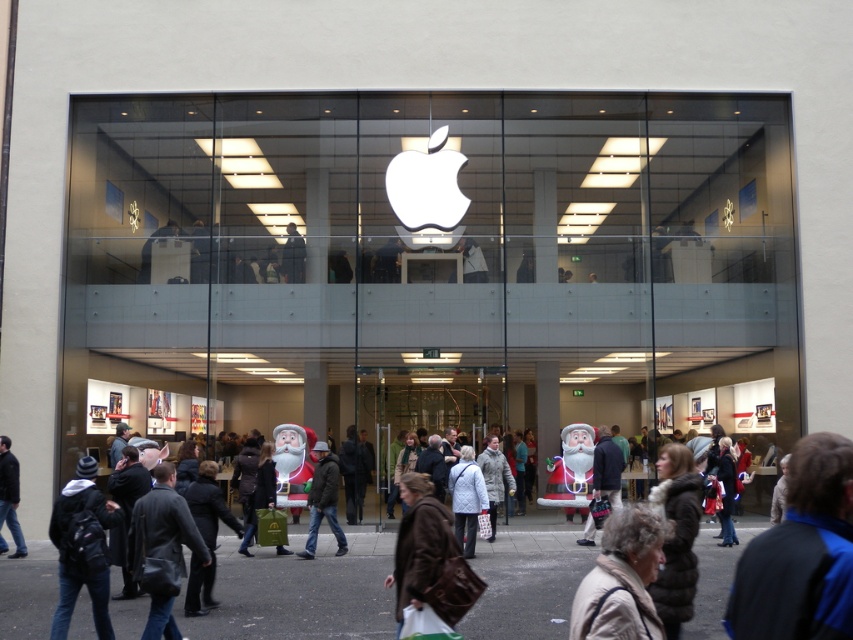
You are a photographer trying to capture a shot of the Apple Store entrance. You need to ensure both the brown leather jacket at lower right and the dark blue jeans at lower left are visible in the frame. Based on their sizes, which object might require you to adjust your camera angle to include both?

The brown leather jacket at lower right occupies less space than dark blue jeans at lower left. Since the dark blue jeans at lower left takes up more space, you might need to adjust your camera angle to ensure it is fully visible in the frame.

You are standing in front of the Apple Store and want to place a new promotional banner between the two points marked as point (x=607, y=570) and point (x=320, y=486). Based on their positions, which point should the banner be closer to in order to be visible to people approaching from the main sidewalk?

The banner should be closer to point (x=607, y=570) because it is in front of point (x=320, y=486), making it more visible to people approaching from the main sidewalk.